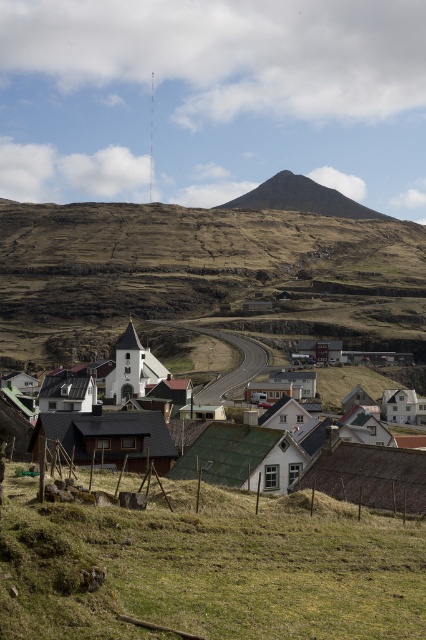
You are a hiker standing at the point marked by the coordinates point (x=209, y=566) in the image. Based on the scene, what type of terrain are you currently standing on?

The point (x=209, y=566) corresponds to the green grassy hillside at lower center, so you are standing on a grassy hillside.

You are a hiker planning to walk from the village towards the rugged hill. You see the green grassy hillside at lower center and the brown grassy hillside at center. Which hillside will you encounter first?

The green grassy hillside at lower center is in front of the brown grassy hillside at center, so you will encounter the green grassy hillside at lower center first.

You are a drone operator tasked with capturing aerial footage of the village. The drone has a maximum flight range of 1400 feet. You need to fly from the green corrugated metal roofs at center to the brown rocky mountain at upper center. Will the drone be able to reach the mountain without exceeding its flight range?

The distance between the green corrugated metal roofs at center and the brown rocky mountain at upper center is 1423.53 feet. Since the drone has a maximum flight range of 1400 feet, it will not be able to reach the mountain without exceeding its flight range.